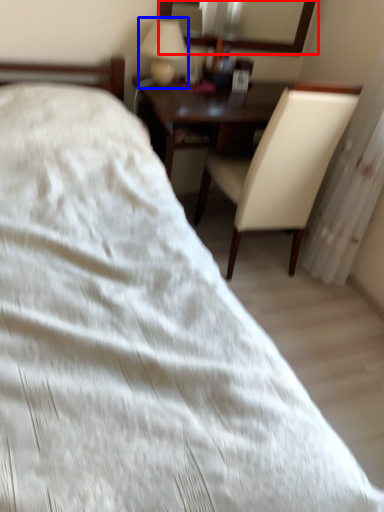
Question: Which object is further to the camera taking this photo, mirror (highlighted by a red box) or table lamp (highlighted by a blue box)?

Choices:
 (A) mirror
 (B) table lamp

Answer: (A)